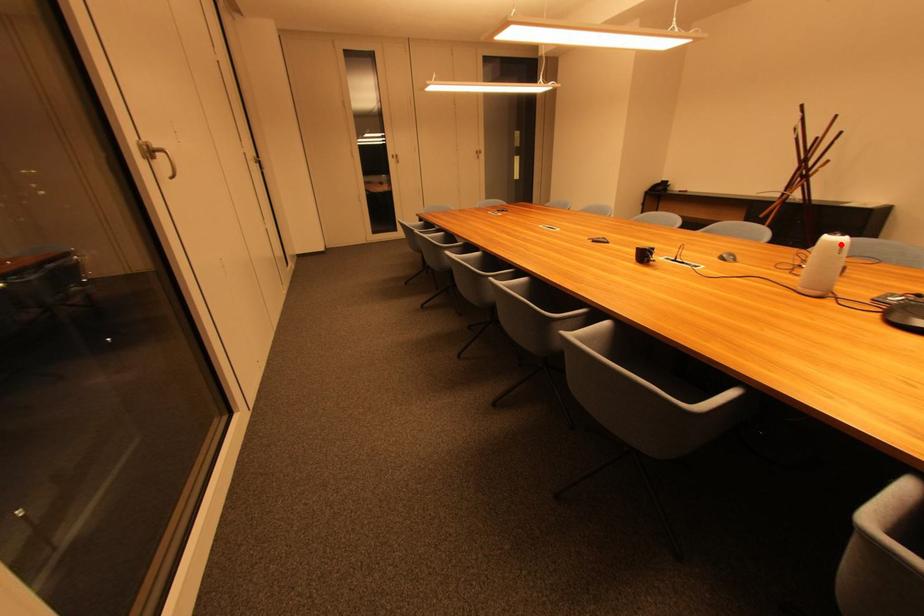
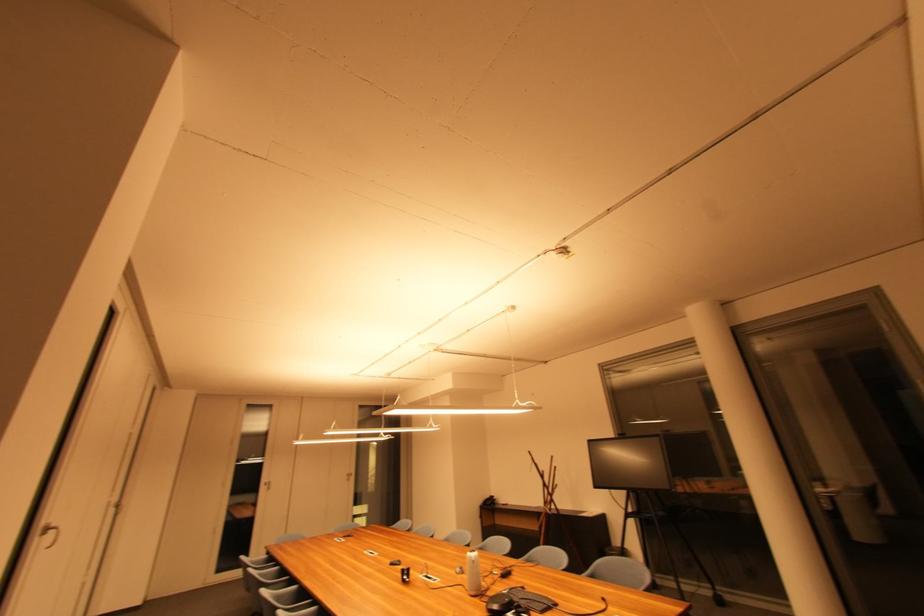
The point at the highlighted location is marked in the first image. Where is the corresponding point in the second image?

(477, 560)